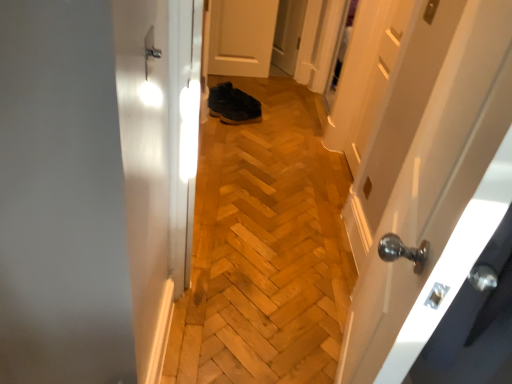
Question: From their relative heights in the image, would you say white glossy door at right, the 2th door when ordered from top to bottom, is taller or shorter than white matte door at center, placed as the 1th door when sorted from top to bottom?

Choices:
 (A) tall
 (B) short

Answer: (A)

Question: Relative to white matte door at center, arranged as the second door when viewed from the front, is white glossy door at right, the 2th door in the back-to-front sequence, in front or behind?

Choices:
 (A) behind
 (B) front

Answer: (B)

Question: Which object is the closest to the white glossy door at right, the 2th door in the back-to-front sequence?

Choices:
 (A) wooden shoes at center
 (B) white matte door at center, marked as the 2th door in a bottom-to-top arrangement
 (C) dark brown leather shoes at center
 (D) satin nickel door handle at upper center

Answer: (A)

Question: Which object is the closest to the white glossy door at right, the 1th door viewed from the front?

Choices:
 (A) dark brown leather shoes at center
 (B) white matte door at center, marked as the 2th door in a bottom-to-top arrangement
 (C) wooden shoes at center
 (D) satin nickel door handle at upper center

Answer: (C)